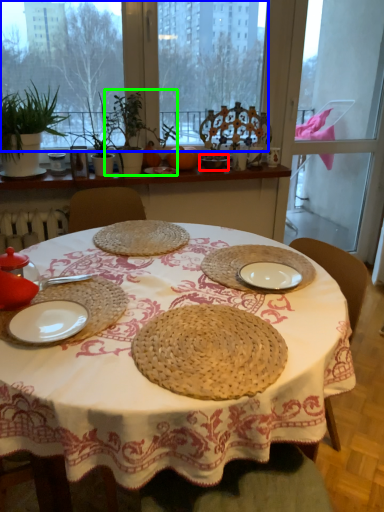
Question: Considering the real-world distances, which object is closest to tableware (highlighted by a red box)? window screen (highlighted by a blue box) or plant (highlighted by a green box).

Choices:
 (A) window screen
 (B) plant

Answer: (B)